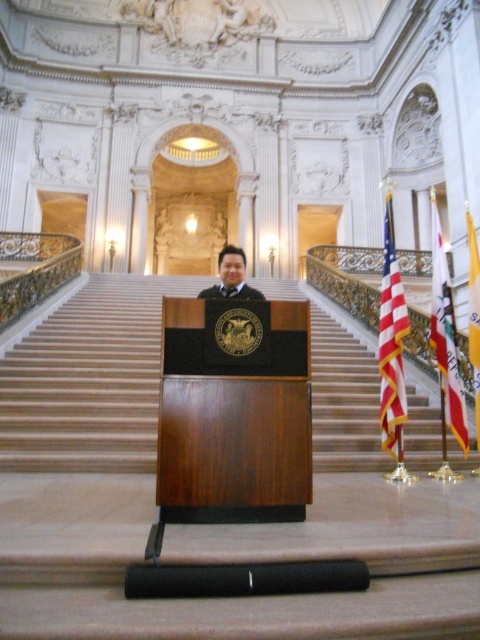
In the scene shown: You are standing in the grand hall and want to reach the point marked at coordinates (463, 388). Given that the hall is 20 meters long, can you estimate whether the point is within the first half of the hall from your current position?

The point marked at coordinates (463, 388) is 16.07 meters away from the viewer. Since the hall is 20 meters long, the first half would be up to 10 meters. Therefore, the point is beyond the first half of the hall.